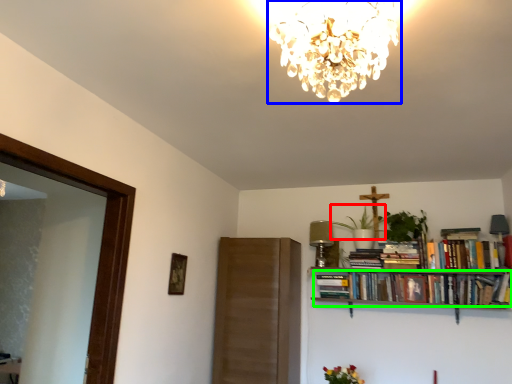
Question: Which object is the farthest from plant (highlighted by a red box)? Choose among these: lamp (highlighted by a blue box) or book (highlighted by a green box).

Choices:
 (A) lamp
 (B) book

Answer: (A)